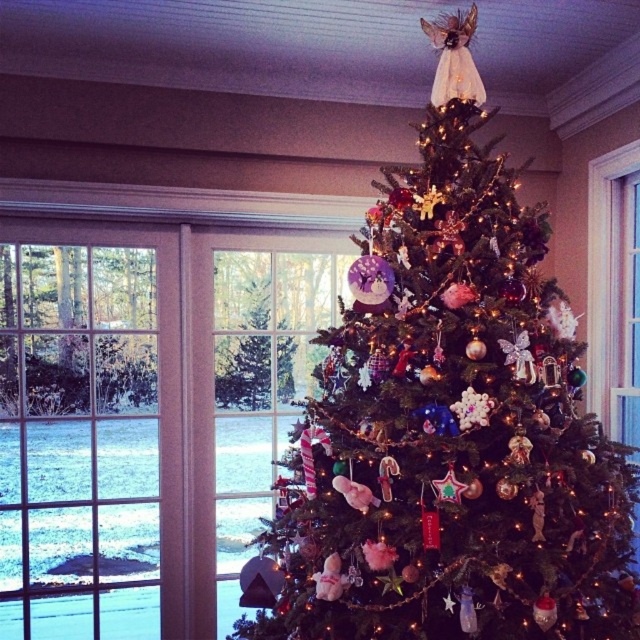
Question: Can you confirm if shiny green tree at center is wider than green matte tree at center?

Choices:
 (A) yes
 (B) no

Answer: (A)

Question: Which point is closer to the camera?

Choices:
 (A) pyautogui.click(x=550, y=365)
 (B) pyautogui.click(x=268, y=364)
 (C) pyautogui.click(x=195, y=564)

Answer: (A)

Question: Among these points, which one is nearest to the camera?

Choices:
 (A) (429, 268)
 (B) (244, 289)

Answer: (A)

Question: Is shiny green tree at center further to the viewer compared to clear glass window at center?

Choices:
 (A) no
 (B) yes

Answer: (A)

Question: Does clear glass window at center have a smaller size compared to green matte tree at center?

Choices:
 (A) yes
 (B) no

Answer: (B)

Question: Which object is the closest to the shiny green tree at center?

Choices:
 (A) green matte tree at center
 (B) clear glass window at center

Answer: (B)